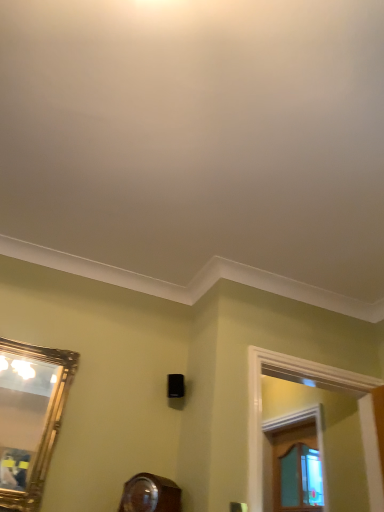
Question: Is wooden window frame at right, which ranks as the first window frame in back-to-front order, spatially inside white wood window frame at upper right, placed as the second window frame when sorted from back to front, or outside of it?

Choices:
 (A) inside
 (B) outside

Answer: (B)

Question: In the image, is wooden window frame at right, the 2th window frame viewed from the front, positioned in front of or behind white wood window frame at upper right, the first window frame from the front?

Choices:
 (A) front
 (B) behind

Answer: (B)

Question: Considering the real-world distances, which object is closest to the wooden window frame at right, the 2th window frame viewed from the front?

Choices:
 (A) gold-framed mirror at left
 (B) white wood window frame at upper right, placed as the second window frame when sorted from back to front

Answer: (B)

Question: Which of these objects is positioned closest to the white wood window frame at upper right, the first window frame from the front?

Choices:
 (A) wooden window frame at right, which ranks as the first window frame in back-to-front order
 (B) gold-framed mirror at left

Answer: (A)